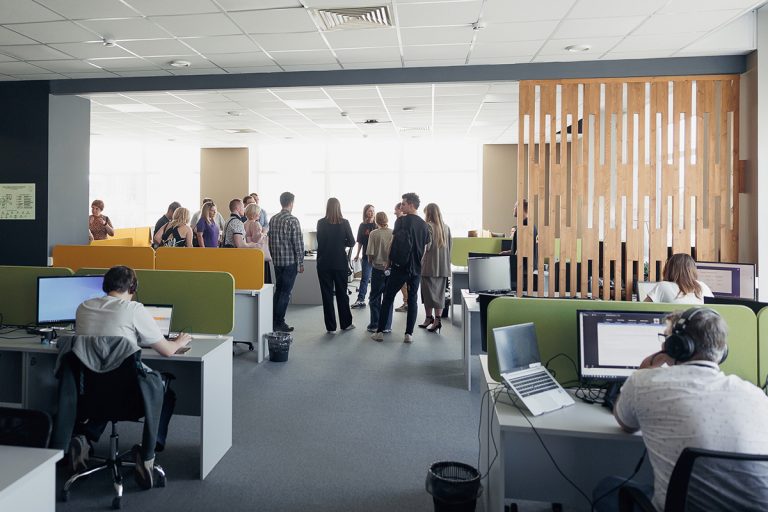
Find the location of a particular element. computers is located at coordinates (41, 300), (157, 316), (528, 382), (618, 353), (730, 273), (507, 242).